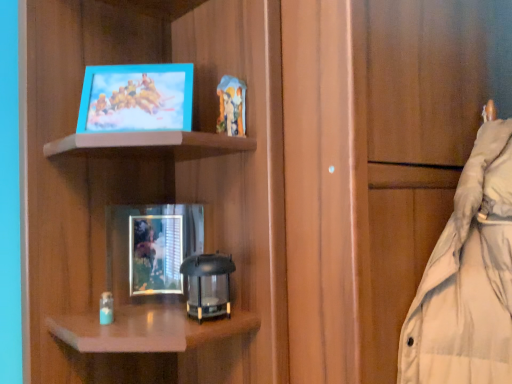
Question: From their relative heights in the image, would you say matte wood cabinet at center is taller or shorter than metallic silver picture frame at center, the 1th picture frame viewed from the back?

Choices:
 (A) tall
 (B) short

Answer: (A)

Question: Based on their positions, is matte wood cabinet at center located to the left or right of metallic silver picture frame at center, the 1th picture frame viewed from the back?

Choices:
 (A) right
 (B) left

Answer: (A)

Question: Estimate the real-world distances between objects in this image. Which object is farther from the metallic silver picture frame at center, which is the second picture frame in top-to-bottom order?

Choices:
 (A) matte blue picture frame at upper left, which is counted as the 1th picture frame, starting from the top
 (B) matte wood cabinet at center

Answer: (B)

Question: Estimate the real-world distances between objects in this image. Which object is farther from the matte blue picture frame at upper left, positioned as the 2th picture frame in bottom-to-top order?

Choices:
 (A) matte wood cabinet at center
 (B) metallic silver picture frame at center, which is the 2th picture frame from front to back

Answer: (A)